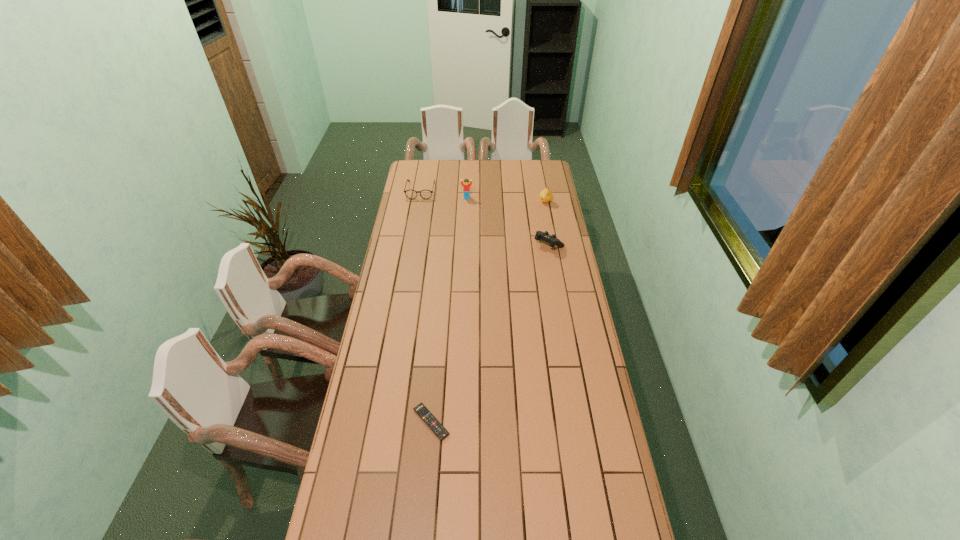
The image size is (960, 540). I want to click on free space between the leftmost object and the tallest object, so click(x=444, y=194).

The width and height of the screenshot is (960, 540). What are the coordinates of `free spot between the remote control and the tallest object` in the screenshot? It's located at (449, 310).

Find the location of a particular element. The height and width of the screenshot is (540, 960). vacant space in between the nearest object and the second nearest object is located at coordinates (490, 333).

I want to click on vacant area that lies between the leftmost object and the nearest object, so click(x=426, y=306).

Identify the location of free space between the shortest object and the spectacles. [x=426, y=306].

In order to click on free space between the nearest object and the leftmost object in this screenshot , I will do `click(426, 306)`.

Find the location of `free area in between the fourth farthest object and the shortest object`. free area in between the fourth farthest object and the shortest object is located at coordinates (490, 333).

Locate an element on the screen. The width and height of the screenshot is (960, 540). vacant area between the leftmost object and the control is located at coordinates (485, 218).

Choose which object is the fourth nearest neighbor to the shortest object. Please provide its 2D coordinates. Your answer should be formatted as a tuple, i.e. [(x, y)], where the tuple contains the x and y coordinates of a point satisfying the conditions above.

[(546, 195)]

Identify the location of the closest object to the tallest object. The width and height of the screenshot is (960, 540). (411, 194).